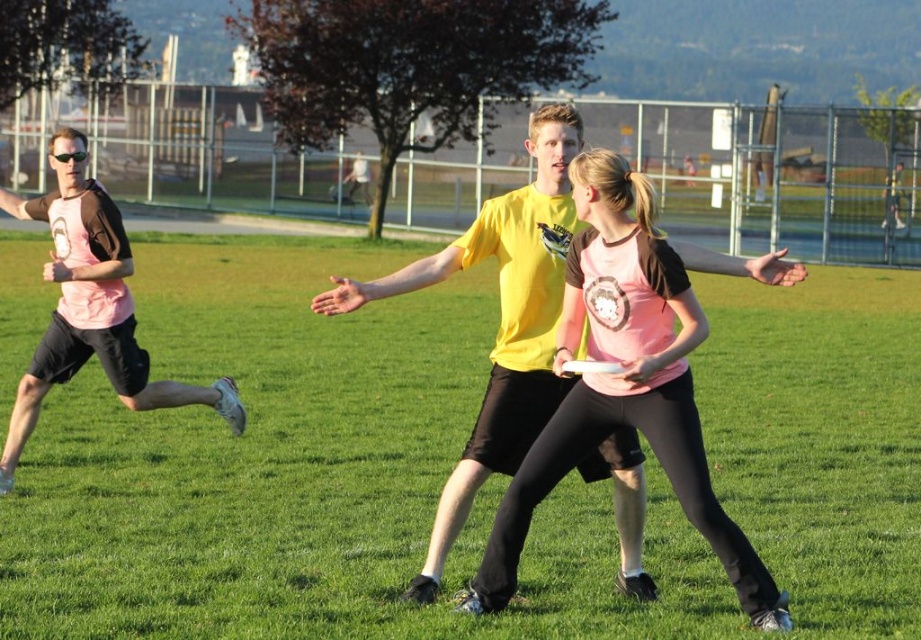
Question: Does pink matte jersey at center appear under pink matte t-shirt at left?

Choices:
 (A) yes
 (B) no

Answer: (A)

Question: Is pink matte jersey at center in front of pink matte t-shirt at left?

Choices:
 (A) yes
 (B) no

Answer: (A)

Question: Which of these objects is positioned closest to the green grass at center?

Choices:
 (A) pink matte jersey at center
 (B) pink matte t-shirt at left

Answer: (A)

Question: Which of the following is the closest to the observer?

Choices:
 (A) pink matte t-shirt at left
 (B) green grass at center
 (C) pink matte jersey at center

Answer: (C)

Question: Which point appears closest to the camera in this image?

Choices:
 (A) (64, 273)
 (B) (726, 376)

Answer: (A)

Question: In this image, where is pink matte jersey at center located relative to pink matte t-shirt at left?

Choices:
 (A) above
 (B) below

Answer: (B)